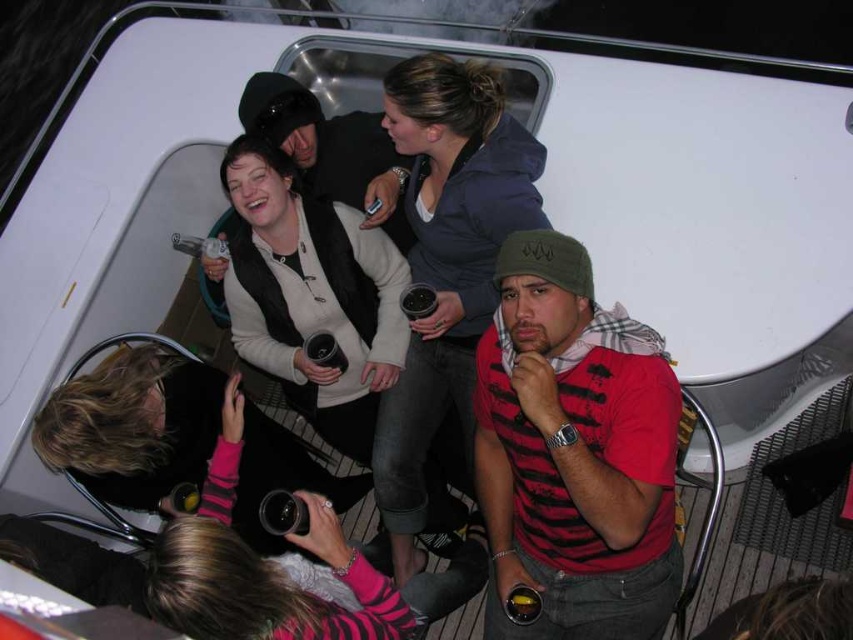
Question: Among these points, which one is nearest to the camera?

Choices:
 (A) (421, 220)
 (B) (561, 618)
 (C) (285, 344)
 (D) (389, 221)

Answer: (B)

Question: Which is nearer to the matte black jacket at upper center?

Choices:
 (A) red striped shirt at center
 (B) white matte sweater at center

Answer: (B)

Question: Which of the following is the closest to the observer?

Choices:
 (A) red striped shirt at center
 (B) dark gray hoodie at upper center
 (C) matte black jacket at upper center
 (D) white matte sweater at center

Answer: (A)

Question: Does red striped shirt at center come in front of dark gray hoodie at upper center?

Choices:
 (A) no
 (B) yes

Answer: (B)

Question: Is red striped shirt at center closer to camera compared to matte black jacket at upper center?

Choices:
 (A) yes
 (B) no

Answer: (A)

Question: From the image, what is the correct spatial relationship of dark gray hoodie at upper center in relation to matte black jacket at upper center?

Choices:
 (A) left
 (B) right

Answer: (B)